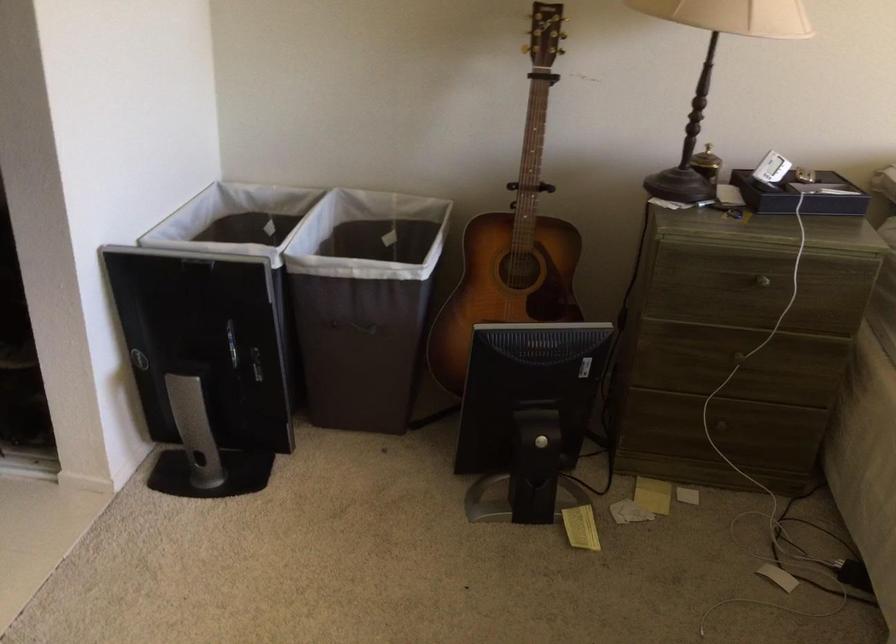
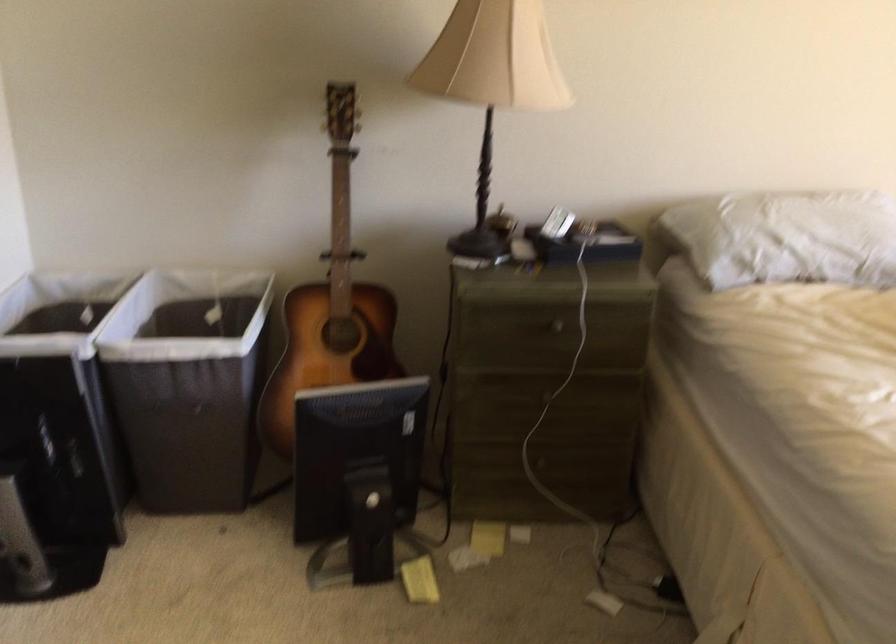
Find the pixel in the second image that matches the point at 351,324 in the first image.

(181, 406)